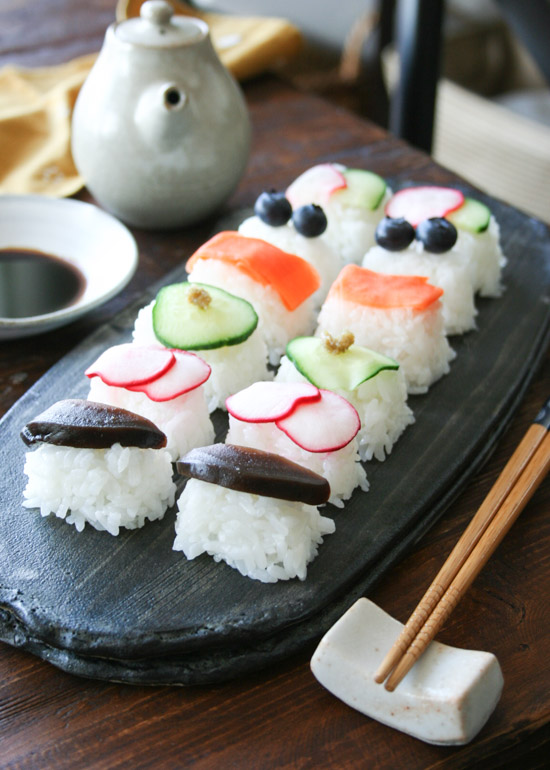
Find the location of a particular element. The image size is (550, 770). jar with spout is located at coordinates (150, 165).